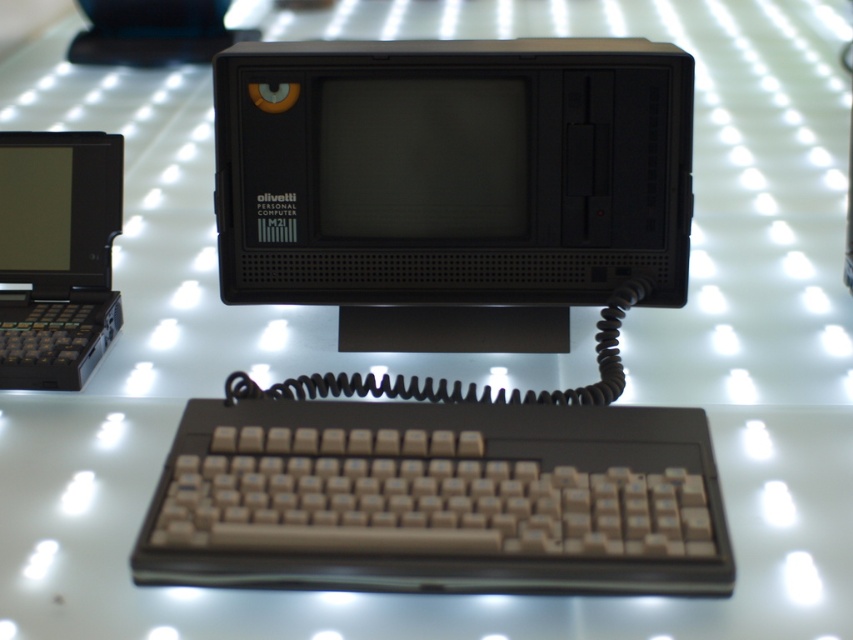
You are a technician inspecting the vintage setup. You need to reach both the beige plastic keyboard at center and the black plastic laptop at left. Which object will you encounter first as you approach the display?

The beige plastic keyboard at center is closer to the viewer than the black plastic laptop at left, so you will encounter the beige plastic keyboard at center first.

You are setting up a desk for this vintage setup. The desk has a width of 1.2 meters. If the black plastic computer at center and black plastic computer monitor at center are placed side by side, will they fit within the desk width?

The black plastic computer at center is wider than the black plastic computer monitor at center. Since the desk is 1.2 meters wide, and the combined width of both devices would exceed the desk width, they will not fit side by side.

You are setting up a display for a tech exhibition and need to place a black plastic computer at center and a black plastic computer monitor at center. The display area has a strict rule that items must be at least 3 inches apart. Will the current placement comply with the exhibition requirements?

The distance between the black plastic computer at center and the black plastic computer monitor at center is 2.53 inches, which is less than the required 3 inches. Therefore, the current placement does not comply with the exhibition requirements.